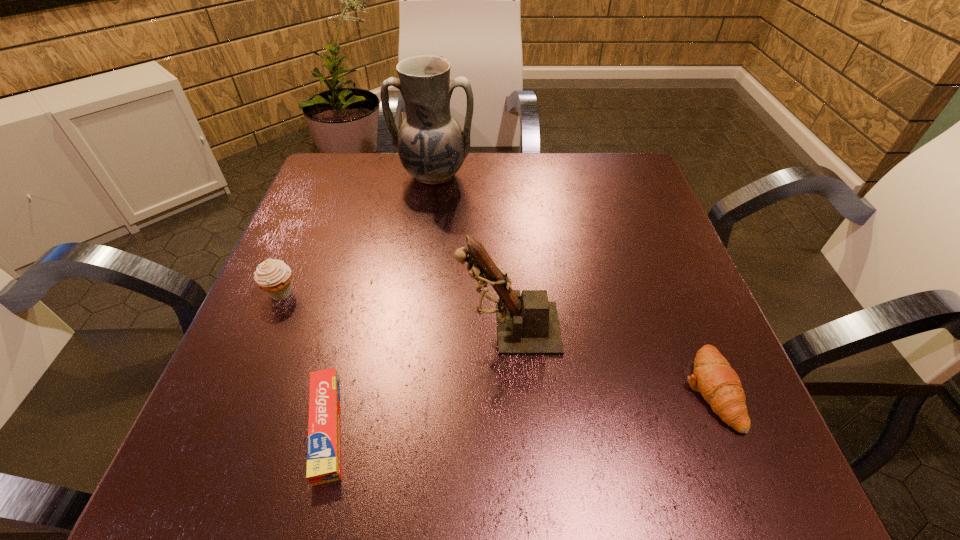
Where is `vacant area located 0.110m on the front-facing side of the figurine`? vacant area located 0.110m on the front-facing side of the figurine is located at coordinates (396, 328).

Locate an element on the screen. This screenshot has width=960, height=540. vacant space located on the front-facing side of the figurine is located at coordinates (350, 328).

At what (x,y) coordinates should I click in order to perform the action: click on vacant area located 0.360m on the back of the leftmost object. Please return your answer as a coordinate pair (x, y). The width and height of the screenshot is (960, 540). Looking at the image, I should click on (x=329, y=178).

Locate an element on the screen. The image size is (960, 540). vacant space located 0.320m on the left of the fourth tallest object is located at coordinates (483, 389).

Identify the location of free region located 0.250m on the back of the toothpaste. Image resolution: width=960 pixels, height=540 pixels. (367, 268).

Identify the location of object located at the far edge. (432, 147).

Find the location of a particular element. The width and height of the screenshot is (960, 540). crescent roll that is positioned at the near edge is located at coordinates (719, 384).

Locate an element on the screen. The width and height of the screenshot is (960, 540). toothpaste that is at the near edge is located at coordinates (323, 451).

You are a GUI agent. You are given a task and a screenshot of the screen. Output one action in this format:
    pyautogui.click(x=<x>, y=<y>)
    Task: Click on the muffin at the left edge
    
    Given the screenshot: What is the action you would take?
    pyautogui.click(x=273, y=276)

You are a GUI agent. You are given a task and a screenshot of the screen. Output one action in this format:
    pyautogui.click(x=<x>, y=<y>)
    Task: Click on the toothpaste that is at the left edge
    The image size is (960, 540).
    Given the screenshot: What is the action you would take?
    pyautogui.click(x=323, y=451)